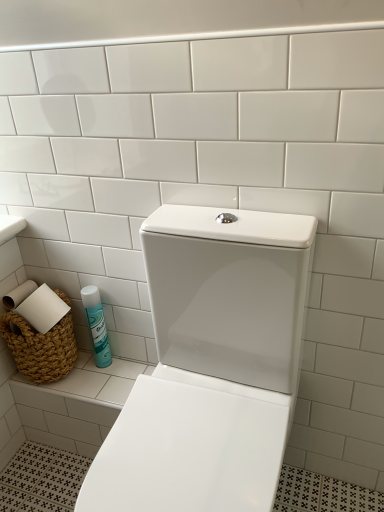
Question: Is blue glossy can at lower left inside white glossy toilet at center?

Choices:
 (A) yes
 (B) no

Answer: (B)

Question: From the image's perspective, is white glossy toilet at center under blue glossy can at lower left?

Choices:
 (A) no
 (B) yes

Answer: (B)

Question: Can you confirm if white glossy toilet at center is thinner than blue glossy can at lower left?

Choices:
 (A) no
 (B) yes

Answer: (A)

Question: Considering the relative positions of white glossy toilet at center and blue glossy can at lower left in the image provided, is white glossy toilet at center to the left of blue glossy can at lower left from the viewer's perspective?

Choices:
 (A) yes
 (B) no

Answer: (B)

Question: Does white glossy toilet at center have a greater height compared to blue glossy can at lower left?

Choices:
 (A) no
 (B) yes

Answer: (B)

Question: Considering their positions, is braided wicker basket at lower left located in front of or behind blue glossy can at lower left?

Choices:
 (A) behind
 (B) front

Answer: (B)

Question: From a real-world perspective, is braided wicker basket at lower left above or below blue glossy can at lower left?

Choices:
 (A) below
 (B) above

Answer: (B)

Question: Is point pos(66,368) closer or farther from the camera than point pos(107,338)?

Choices:
 (A) farther
 (B) closer

Answer: (B)

Question: Visually, is braided wicker basket at lower left positioned to the left or to the right of blue glossy can at lower left?

Choices:
 (A) right
 (B) left

Answer: (B)

Question: Would you say white glossy toilet at center is inside or outside blue glossy can at lower left?

Choices:
 (A) inside
 (B) outside

Answer: (B)

Question: Looking at their shapes, would you say white glossy toilet at center is wider or thinner than blue glossy can at lower left?

Choices:
 (A) thin
 (B) wide

Answer: (B)

Question: From a real-world perspective, is white glossy toilet at center above or below blue glossy can at lower left?

Choices:
 (A) below
 (B) above

Answer: (B)

Question: From the image's perspective, relative to blue glossy can at lower left, is white glossy toilet at center above or below?

Choices:
 (A) above
 (B) below

Answer: (B)

Question: Visually, is blue glossy can at lower left positioned to the left or to the right of white glossy toilet at center?

Choices:
 (A) left
 (B) right

Answer: (A)

Question: From a real-world perspective, relative to white glossy toilet at center, is blue glossy can at lower left vertically above or below?

Choices:
 (A) below
 (B) above

Answer: (A)